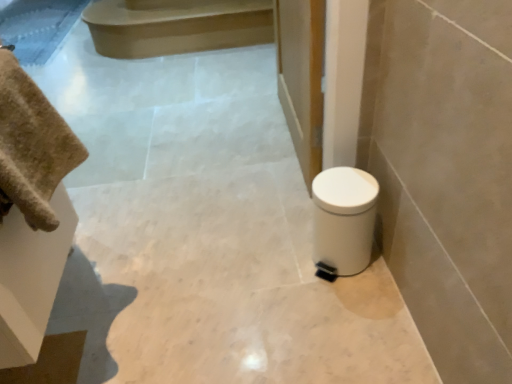
Question: Is beige cotton towel at left not inside smooth beige stair at upper center?

Choices:
 (A) no
 (B) yes

Answer: (B)

Question: Considering the relative positions of beige cotton towel at left and smooth beige stair at upper center in the image provided, is beige cotton towel at left behind smooth beige stair at upper center?

Choices:
 (A) no
 (B) yes

Answer: (A)

Question: Does beige cotton towel at left appear on the right side of smooth beige stair at upper center?

Choices:
 (A) no
 (B) yes

Answer: (B)

Question: Considering the relative sizes of beige cotton towel at left and smooth beige stair at upper center in the image provided, is beige cotton towel at left thinner than smooth beige stair at upper center?

Choices:
 (A) no
 (B) yes

Answer: (B)

Question: From a real-world perspective, is beige cotton towel at left on top of smooth beige stair at upper center?

Choices:
 (A) no
 (B) yes

Answer: (B)

Question: Is beige cotton towel at left smaller than smooth beige stair at upper center?

Choices:
 (A) no
 (B) yes

Answer: (B)

Question: From the image's perspective, is white plastic toilet at lower right below beige cotton towel at left?

Choices:
 (A) yes
 (B) no

Answer: (A)

Question: Would you consider white plastic toilet at lower right to be distant from beige cotton towel at left?

Choices:
 (A) no
 (B) yes

Answer: (A)

Question: Is the depth of white plastic toilet at lower right less than that of beige cotton towel at left?

Choices:
 (A) no
 (B) yes

Answer: (A)

Question: Can you confirm if white plastic toilet at lower right is wider than beige cotton towel at left?

Choices:
 (A) yes
 (B) no

Answer: (A)

Question: Considering the relative positions of white plastic toilet at lower right and beige cotton towel at left in the image provided, is white plastic toilet at lower right to the right of beige cotton towel at left from the viewer's perspective?

Choices:
 (A) yes
 (B) no

Answer: (A)

Question: Can you confirm if white plastic toilet at lower right is taller than beige cotton towel at left?

Choices:
 (A) yes
 (B) no

Answer: (A)

Question: Is beige cotton towel at left to the left of white plastic toilet at lower right from the viewer's perspective?

Choices:
 (A) yes
 (B) no

Answer: (A)